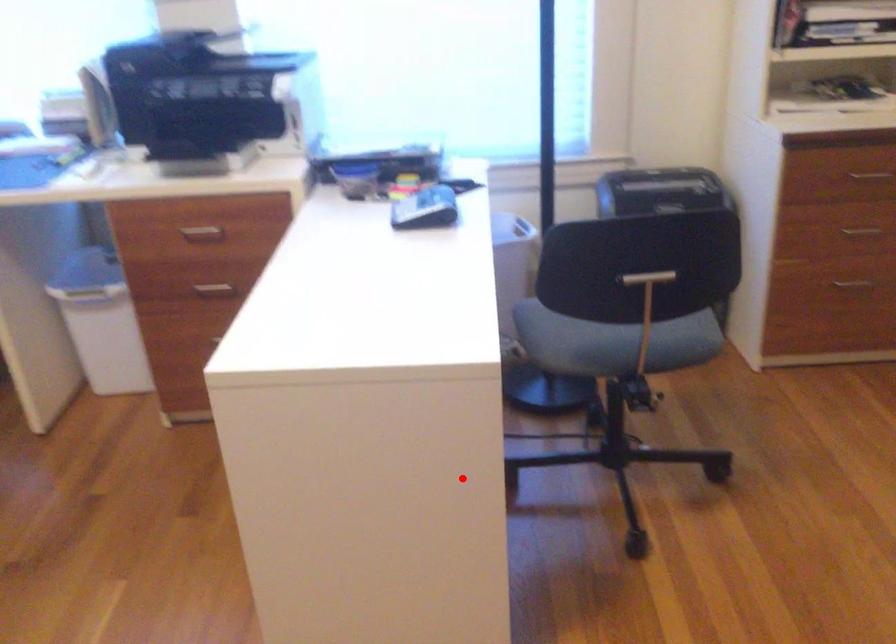
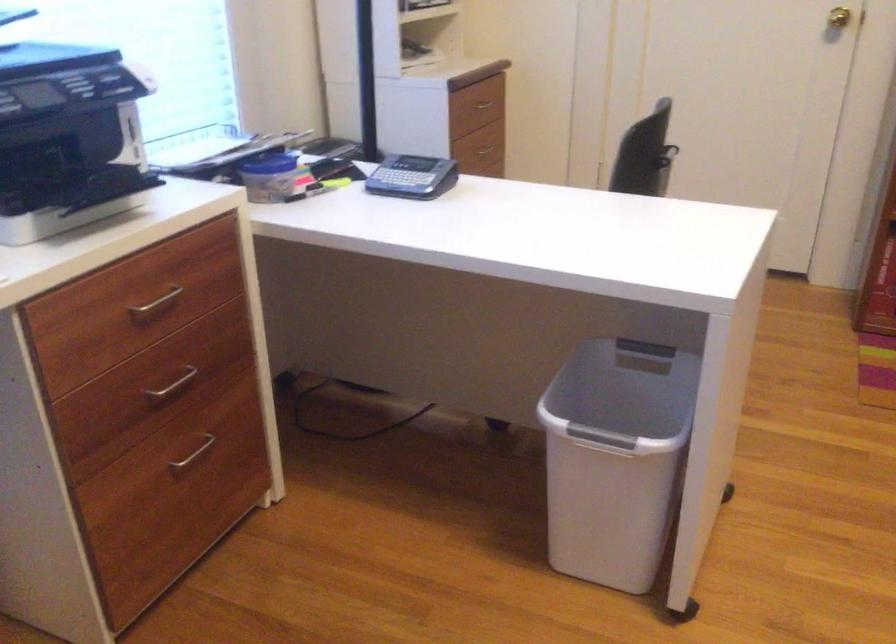
In the second image, find the point that corresponds to the highlighted location in the first image.

(625, 389)